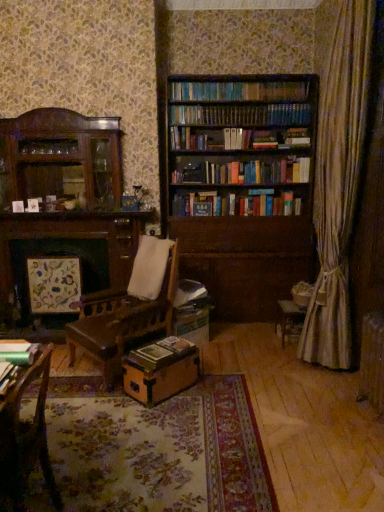
Question: Which direction should I rotate to look at hardcover book at center, which appears as the first book when ordered from the bottom?

Choices:
 (A) left
 (B) right

Answer: (A)

Question: Is brown cardboard box at center outside brown wooden bookcase at center?

Choices:
 (A) yes
 (B) no

Answer: (A)

Question: Is brown cardboard box at center in contact with brown wooden bookcase at center?

Choices:
 (A) yes
 (B) no

Answer: (B)

Question: Is brown cardboard box at center to the left of brown wooden bookcase at center from the viewer's perspective?

Choices:
 (A) no
 (B) yes

Answer: (B)

Question: Is brown cardboard box at center turned away from brown wooden bookcase at center?

Choices:
 (A) yes
 (B) no

Answer: (A)

Question: Is brown cardboard box at center smaller than brown wooden bookcase at center?

Choices:
 (A) yes
 (B) no

Answer: (A)

Question: Is brown cardboard box at center not close to brown wooden bookcase at center?

Choices:
 (A) no
 (B) yes

Answer: (B)

Question: Could you tell me if hardcover book at center, which is the 2th book in left-to-right order, is turned towards metallic green book at lower left, arranged as the first book when viewed from the top?

Choices:
 (A) no
 (B) yes

Answer: (A)

Question: Is hardcover book at center, which is counted as the first book, starting from the right, closer to the viewer compared to metallic green book at lower left, placed as the second book when sorted from back to front?

Choices:
 (A) no
 (B) yes

Answer: (A)

Question: Does hardcover book at center, which is the 2th book in left-to-right order, have a lesser width compared to metallic green book at lower left, arranged as the first book when viewed from the top?

Choices:
 (A) yes
 (B) no

Answer: (A)

Question: Considering the relative sizes of hardcover book at center, arranged as the 1th book when viewed from the back, and metallic green book at lower left, which ranks as the 1th book in left-to-right order, in the image provided, is hardcover book at center, arranged as the 1th book when viewed from the back, bigger than metallic green book at lower left, which ranks as the 1th book in left-to-right order,?

Choices:
 (A) no
 (B) yes

Answer: (A)

Question: Can we say hardcover book at center, which appears as the first book when ordered from the bottom, lies outside metallic green book at lower left, placed as the second book when sorted from back to front?

Choices:
 (A) no
 (B) yes

Answer: (B)

Question: Is hardcover book at center, which is the second book from top to bottom, wider than metallic green book at lower left, the first book positioned from the front?

Choices:
 (A) yes
 (B) no

Answer: (B)

Question: From the image's perspective, is metallic green book at lower left, the 2th book from the right, located above wooden chair at lower left?

Choices:
 (A) no
 (B) yes

Answer: (B)